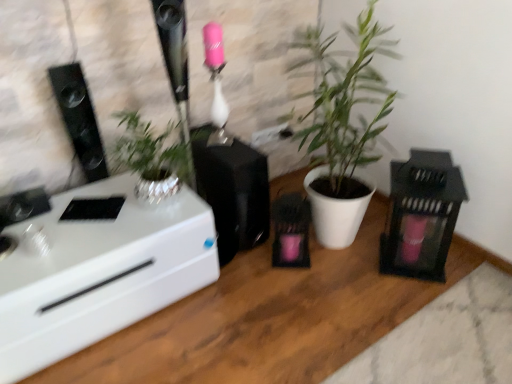
Question: Is there a large distance between black matte lantern at right, which is the 2th appliance from left to right, and black matte speaker at center, which is counted as the first appliance, starting from the left?

Choices:
 (A) no
 (B) yes

Answer: (A)

Question: Is black matte lantern at right, which is the 2th appliance from left to right, facing away from black matte speaker at center, which is counted as the first appliance, starting from the left?

Choices:
 (A) yes
 (B) no

Answer: (B)

Question: Considering the relative sizes of black matte lantern at right, which is the 2th appliance from left to right, and black matte speaker at center, which is counted as the first appliance, starting from the left, in the image provided, is black matte lantern at right, which is the 2th appliance from left to right, shorter than black matte speaker at center, which is counted as the first appliance, starting from the left,?

Choices:
 (A) yes
 (B) no

Answer: (B)

Question: Is black matte lantern at right, which is the 2th appliance from left to right, closer to camera compared to black matte speaker at center, arranged as the second appliance when viewed from the right?

Choices:
 (A) no
 (B) yes

Answer: (B)

Question: Is black matte lantern at right, which is the 2th appliance from left to right, oriented towards black matte speaker at center, which is counted as the first appliance, starting from the left?

Choices:
 (A) yes
 (B) no

Answer: (B)

Question: In terms of width, does black matte lantern at right, which is the 2th appliance from left to right, look wider or thinner when compared to white matte plant pot at center?

Choices:
 (A) wide
 (B) thin

Answer: (B)

Question: Considering the relative positions of black matte lantern at right, which is the 2th appliance from left to right, and white matte plant pot at center in the image provided, is black matte lantern at right, which is the 2th appliance from left to right, to the left or to the right of white matte plant pot at center?

Choices:
 (A) left
 (B) right

Answer: (B)

Question: From a real-world perspective, is black matte lantern at right, which is the 2th appliance from left to right, physically located above or below white matte plant pot at center?

Choices:
 (A) below
 (B) above

Answer: (A)

Question: Considering the positions of point (404, 173) and point (301, 61), is point (404, 173) closer or farther from the camera than point (301, 61)?

Choices:
 (A) closer
 (B) farther

Answer: (A)

Question: Considering the positions of white glossy desk at left and black matte speaker at center, which is counted as the first appliance, starting from the left, in the image, is white glossy desk at left taller or shorter than black matte speaker at center, which is counted as the first appliance, starting from the left,?

Choices:
 (A) short
 (B) tall

Answer: (A)

Question: Looking at their shapes, would you say white glossy desk at left is wider or thinner than black matte speaker at center, which is counted as the first appliance, starting from the left?

Choices:
 (A) wide
 (B) thin

Answer: (A)

Question: Does point (97, 193) appear closer or farther from the camera than point (257, 208)?

Choices:
 (A) farther
 (B) closer

Answer: (B)

Question: From a real-world perspective, is white glossy desk at left physically located above or below black matte speaker at center, arranged as the second appliance when viewed from the right?

Choices:
 (A) below
 (B) above

Answer: (A)

Question: From a real-world perspective, is black glossy speaker at left physically located above or below white matte plant pot at center?

Choices:
 (A) below
 (B) above

Answer: (B)

Question: Considering the positions of black glossy speaker at left and white matte plant pot at center in the image, is black glossy speaker at left taller or shorter than white matte plant pot at center?

Choices:
 (A) tall
 (B) short

Answer: (B)